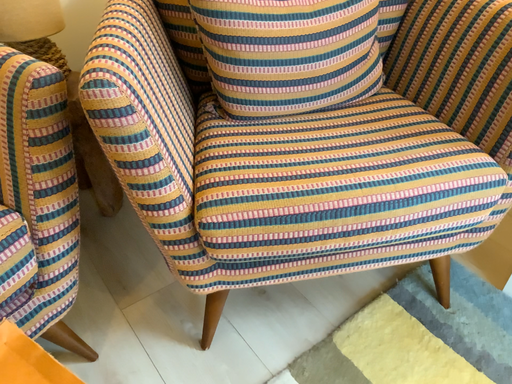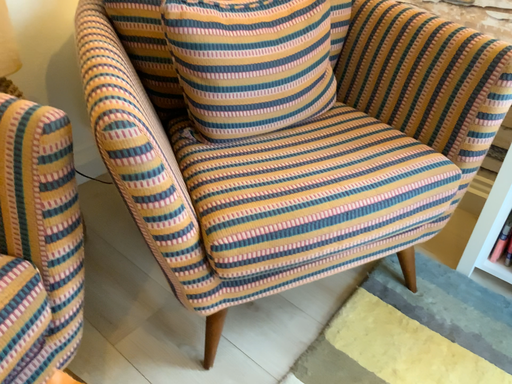
Question: How did the camera likely rotate when shooting the video?

Choices:
 (A) rotated right
 (B) rotated left

Answer: (A)